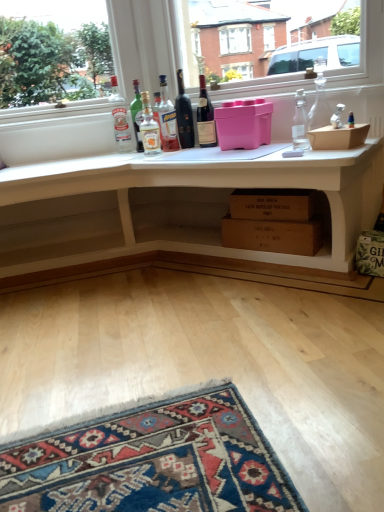
Identify the location of free space that is to the left of clear glass decanter at upper right, the first bottle viewed from the right. This screenshot has height=512, width=384. (280, 147).